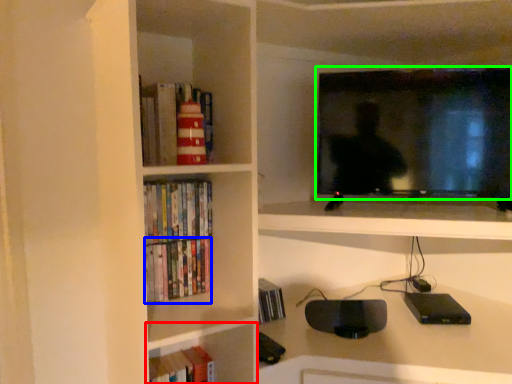
Question: Considering the real-world distances, which object is farthest from shelf (highlighted by a red box)? book (highlighted by a blue box) or television (highlighted by a green box)?

Choices:
 (A) book
 (B) television

Answer: (B)